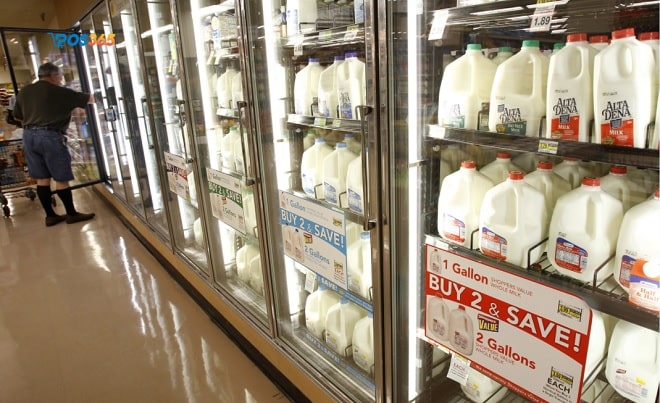
Identify the location of clear fridge display door. This screenshot has width=660, height=403. (411, 213), (370, 202), (244, 175), (176, 136), (143, 128), (116, 128), (38, 45).